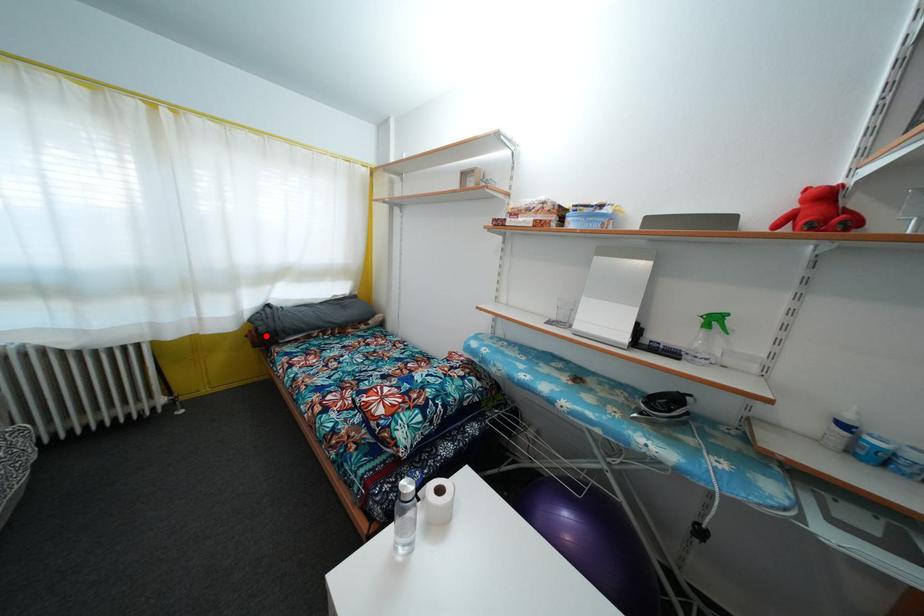
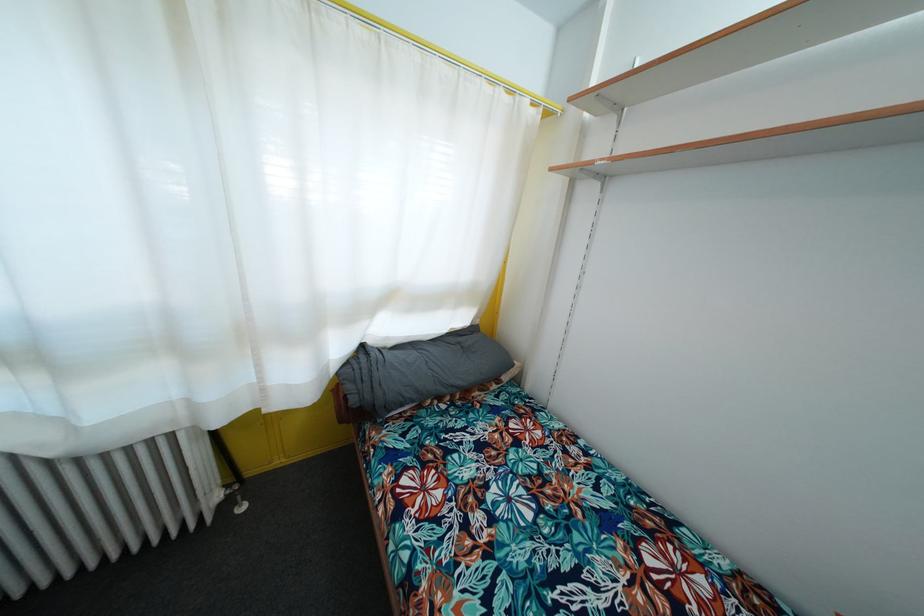
Question: I am providing you with two images of the same scene from different viewpoints. Given a red point in image1, look at the same physical point in image2. Is it:

Choices:
 (A) Closer to the viewpoint
 (B) Farther from the viewpoint

Answer: (B)